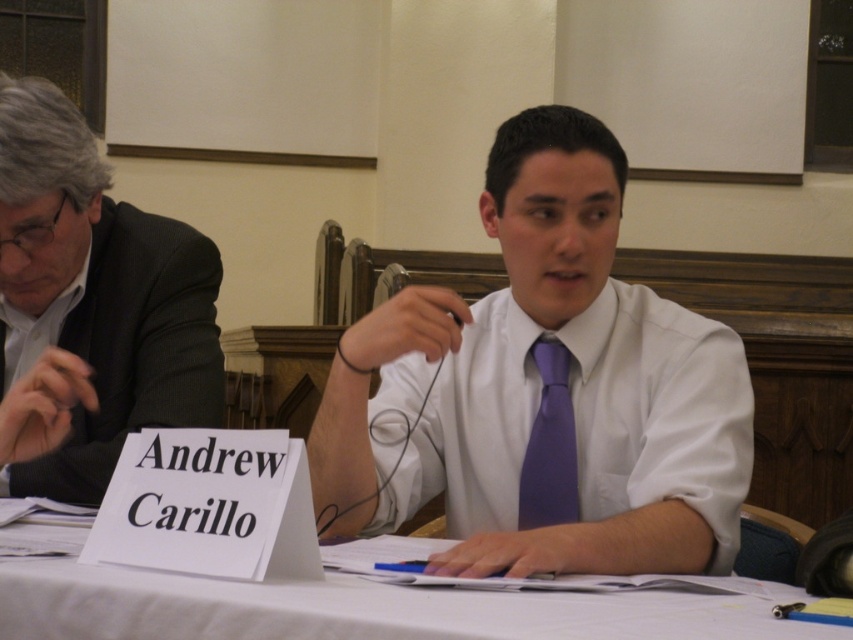
Between point (26, 576) and point (561, 493), which one is positioned in front?

Point (26, 576)

Describe the element at coordinates (363, 609) in the screenshot. The width and height of the screenshot is (853, 640). I see `white paper at center` at that location.

The image size is (853, 640). I want to click on white paper at center, so click(x=363, y=609).

The image size is (853, 640). What do you see at coordinates (544, 390) in the screenshot?
I see `white glossy shirt at center` at bounding box center [544, 390].

Locate an element on the screen. The width and height of the screenshot is (853, 640). white glossy shirt at center is located at coordinates (544, 390).

How far apart are dark gray suit at left and white paper at center?

dark gray suit at left is 19.73 inches from white paper at center.

Is dark gray suit at left closer to camera compared to white paper at center?

No.

Is point (157, 316) more distant than point (837, 632)?

Yes, point (157, 316) is behind point (837, 632).

Identify the location of dark gray suit at left. This screenshot has height=640, width=853. (96, 294).